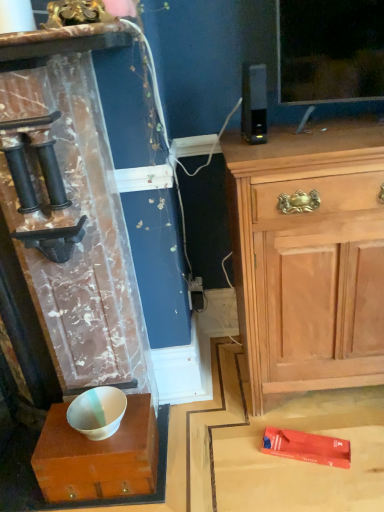
What do you see at coordinates (98, 456) in the screenshot? This screenshot has height=512, width=384. I see `white glossy bowl at center` at bounding box center [98, 456].

This screenshot has height=512, width=384. Describe the element at coordinates (309, 258) in the screenshot. I see `light wood cabinet at upper right` at that location.

The width and height of the screenshot is (384, 512). What do you see at coordinates (97, 412) in the screenshot?
I see `white glossy bowl at lower left` at bounding box center [97, 412].

This screenshot has width=384, height=512. I want to click on white glossy bowl at center, so click(98, 456).

Is white glossy bowl at center at the back of light wood cabinet at upper right?

light wood cabinet at upper right does not have its back to white glossy bowl at center.

Is light wood cabinet at upper right next to white glossy bowl at center?

No, light wood cabinet at upper right is not in contact with white glossy bowl at center.

Measure the distance between light wood cabinet at upper right and white glossy bowl at center.

light wood cabinet at upper right and white glossy bowl at center are 25.23 inches apart.

Which is behind, point (363, 244) or point (110, 454)?

The point (363, 244) is more distant.

Is white glossy bowl at center oriented away from white glossy bowl at lower left?

No.

How many degrees apart are the facing directions of white glossy bowl at center and white glossy bowl at lower left?

They differ by 0.677 degrees in their facing directions.

Identify the location of cabinetry that appears below the white glossy bowl at lower left (from a real-world perspective). (98, 456).

Are white glossy bowl at center and white glossy bowl at lower left beside each other?

Yes, white glossy bowl at center is touching white glossy bowl at lower left.

From a real-world perspective, is white glossy bowl at lower left physically above light wood cabinet at upper right?

Incorrect, from a real-world perspective, white glossy bowl at lower left is lower than light wood cabinet at upper right.

Can you tell me how much white glossy bowl at lower left and light wood cabinet at upper right differ in facing direction?

The angle between the facing direction of white glossy bowl at lower left and the facing direction of light wood cabinet at upper right is 0.631 degrees.

How distant is white glossy bowl at lower left from light wood cabinet at upper right?

white glossy bowl at lower left is 28.44 inches from light wood cabinet at upper right.

Considering the positions of objects white glossy bowl at lower left and light wood cabinet at upper right in the image provided, who is more to the right, white glossy bowl at lower left or light wood cabinet at upper right?

light wood cabinet at upper right is more to the right.

Considering the relative positions of light wood cabinet at upper right and white glossy bowl at lower left in the image provided, is light wood cabinet at upper right to the right of white glossy bowl at lower left from the viewer's perspective?

Yes, light wood cabinet at upper right is to the right of white glossy bowl at lower left.

From a real-world perspective, is light wood cabinet at upper right located beneath white glossy bowl at lower left?

No, from a real-world perspective, light wood cabinet at upper right is not below white glossy bowl at lower left.

Are light wood cabinet at upper right and white glossy bowl at lower left far apart?

No, there isn't a large distance between light wood cabinet at upper right and white glossy bowl at lower left.

From the image's perspective, does light wood cabinet at upper right appear lower than white glossy bowl at lower left?

Actually, light wood cabinet at upper right appears above white glossy bowl at lower left in the image.

Does white glossy bowl at center have a smaller size compared to light wood cabinet at upper right?

Correct, white glossy bowl at center occupies less space than light wood cabinet at upper right.

Considering the relative positions of white glossy bowl at center and light wood cabinet at upper right in the image provided, is white glossy bowl at center to the right of light wood cabinet at upper right from the viewer's perspective?

Incorrect, white glossy bowl at center is not on the right side of light wood cabinet at upper right.

Considering the sizes of white glossy bowl at lower left and white glossy bowl at center in the image, is white glossy bowl at lower left wider or thinner than white glossy bowl at center?

Clearly, white glossy bowl at lower left has less width compared to white glossy bowl at center.

Is white glossy bowl at center at the back of white glossy bowl at lower left?

white glossy bowl at lower left is not turned away from white glossy bowl at center.

Can you confirm if white glossy bowl at lower left is bigger than white glossy bowl at center?

No.

Is white glossy bowl at lower left positioned before white glossy bowl at center?

No, it is not.

Find the location of `chest of drawers in front of the white glossy bowl at center`. chest of drawers in front of the white glossy bowl at center is located at coordinates (309, 258).

Identify the location of bowl behind the white glossy bowl at center. (97, 412).

Considering their positions, is white glossy bowl at center positioned further to light wood cabinet at upper right than white glossy bowl at lower left?

Based on the image, white glossy bowl at lower left appears to be further to light wood cabinet at upper right.

When comparing their distances from white glossy bowl at lower left, does light wood cabinet at upper right or white glossy bowl at center seem further?

light wood cabinet at upper right is positioned further to the anchor white glossy bowl at lower left.

Considering their positions, is white glossy bowl at center positioned closer to white glossy bowl at lower left than light wood cabinet at upper right?

Among the two, white glossy bowl at center is located nearer to white glossy bowl at lower left.

In the scene shown: Considering their positions, is light wood cabinet at upper right positioned closer to white glossy bowl at center than white glossy bowl at lower left?

white glossy bowl at lower left.

Based on their spatial positions, is white glossy bowl at lower left or white glossy bowl at center closer to light wood cabinet at upper right?

white glossy bowl at center is positioned closer to the anchor light wood cabinet at upper right.

Looking at the image, which one is located closer to white glossy bowl at center, white glossy bowl at lower left or light wood cabinet at upper right?

white glossy bowl at lower left is closer to white glossy bowl at center.

This screenshot has width=384, height=512. I want to click on bowl situated between white glossy bowl at center and light wood cabinet at upper right from left to right, so click(x=97, y=412).